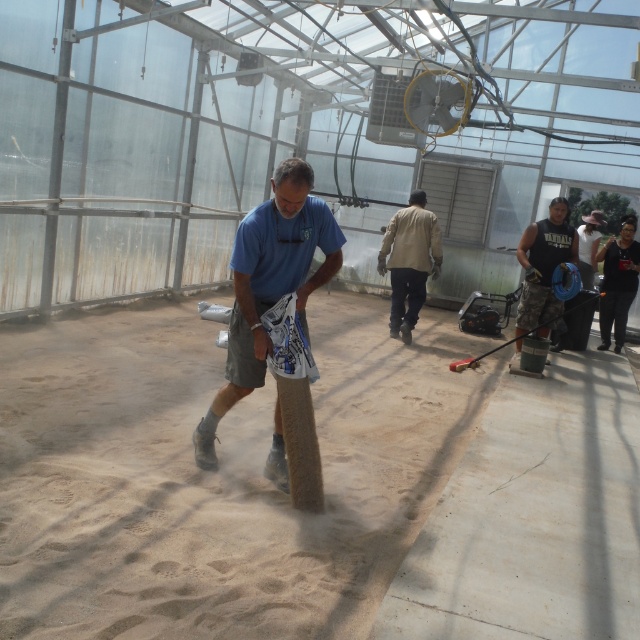
Is point (99, 428) positioned before point (273, 448)?

No, it is not.

Does brown sandy soil at center appear under blue fabric bag at center?

Yes.

Who is more forward, (243,541) or (339,268)?

Point (243,541) is in front.

Identify the location of brown sandy soil at center. The width and height of the screenshot is (640, 640). (216, 474).

Is brown sandy soil at center wider than khaki fabric pants at center?

No, brown sandy soil at center is not wider than khaki fabric pants at center.

Which is more to the right, brown sandy soil at center or khaki fabric pants at center?

Positioned to the right is khaki fabric pants at center.

Between point (154, 460) and point (410, 326), which one is positioned behind?

The point (410, 326) is more distant.

This screenshot has height=640, width=640. Identify the location of brown sandy soil at center. (216, 474).

Is brown sandy soil at center shorter than black sleeveless shirt at center?

Indeed, brown sandy soil at center has a lesser height compared to black sleeveless shirt at center.

What do you see at coordinates (216, 474) in the screenshot? The width and height of the screenshot is (640, 640). I see `brown sandy soil at center` at bounding box center [216, 474].

Locate an element on the screen. brown sandy soil at center is located at coordinates (216, 474).

You are a GUI agent. You are given a task and a screenshot of the screen. Output one action in this format:
    pyautogui.click(x=<x>, y=<y>)
    Task: Click on the brown sandy soil at center
    This screenshot has width=640, height=640.
    Given the screenshot: What is the action you would take?
    pyautogui.click(x=216, y=474)